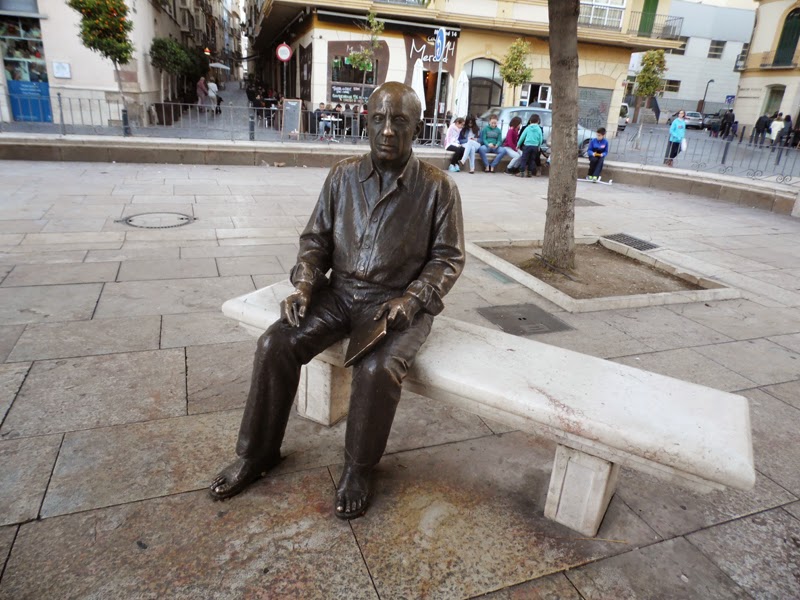
This screenshot has height=600, width=800. Find the location of `bench`. bench is located at coordinates (556, 390).